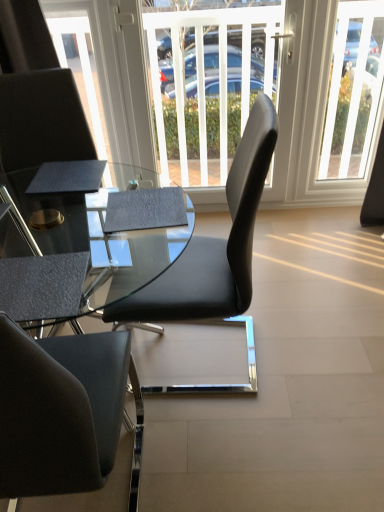
Question: Would you say textured black armchair at lower left is outside black leather chair at left, which ranks as the 1th chair in left-to-right order?

Choices:
 (A) no
 (B) yes

Answer: (B)

Question: Is textured black armchair at lower left positioned with its back to black leather chair at left, placed as the 2th chair when sorted from right to left?

Choices:
 (A) yes
 (B) no

Answer: (B)

Question: From the image's perspective, is textured black armchair at lower left below black leather chair at left, which ranks as the 1th chair in left-to-right order?

Choices:
 (A) no
 (B) yes

Answer: (B)

Question: Can you confirm if textured black armchair at lower left is taller than black leather chair at left, placed as the 2th chair when sorted from right to left?

Choices:
 (A) yes
 (B) no

Answer: (B)

Question: Is textured black armchair at lower left oriented towards black leather chair at left, which ranks as the 1th chair in left-to-right order?

Choices:
 (A) yes
 (B) no

Answer: (A)

Question: Considering the positions of point (33, 121) and point (347, 95), is point (33, 121) closer or farther from the camera than point (347, 95)?

Choices:
 (A) farther
 (B) closer

Answer: (B)

Question: Visually, is black leather chair at left, placed as the 2th chair when sorted from right to left, positioned to the left or to the right of clear glass door at upper center?

Choices:
 (A) right
 (B) left

Answer: (B)

Question: Looking at the image, does black leather chair at left, which ranks as the 1th chair in left-to-right order, seem bigger or smaller compared to clear glass door at upper center?

Choices:
 (A) small
 (B) big

Answer: (B)

Question: From a real-world perspective, is black leather chair at left, which ranks as the 1th chair in left-to-right order, above or below clear glass door at upper center?

Choices:
 (A) below
 (B) above

Answer: (A)

Question: Considering the positions of point pos(200,197) and point pos(339,46), is point pos(200,197) closer or farther from the camera than point pos(339,46)?

Choices:
 (A) farther
 (B) closer

Answer: (A)

Question: In terms of width, does white matte door at center look wider or thinner when compared to clear glass door at upper center?

Choices:
 (A) wide
 (B) thin

Answer: (A)

Question: In the image, is white matte door at center on the left side or the right side of clear glass door at upper center?

Choices:
 (A) left
 (B) right

Answer: (A)

Question: Relative to clear glass door at upper center, is white matte door at center in front or behind?

Choices:
 (A) front
 (B) behind

Answer: (A)

Question: Is point (365, 120) positioned closer to the camera than point (18, 134)?

Choices:
 (A) farther
 (B) closer

Answer: (A)

Question: Which is correct: clear glass door at upper center is inside black leather chair at left, which ranks as the 1th chair in left-to-right order, or outside of it?

Choices:
 (A) outside
 (B) inside

Answer: (A)